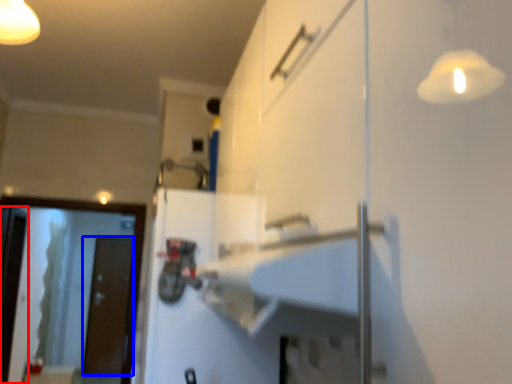
Question: Among these objects, which one is farthest to the camera, screen door (highlighted by a red box) or door (highlighted by a blue box)?

Choices:
 (A) screen door
 (B) door

Answer: (B)